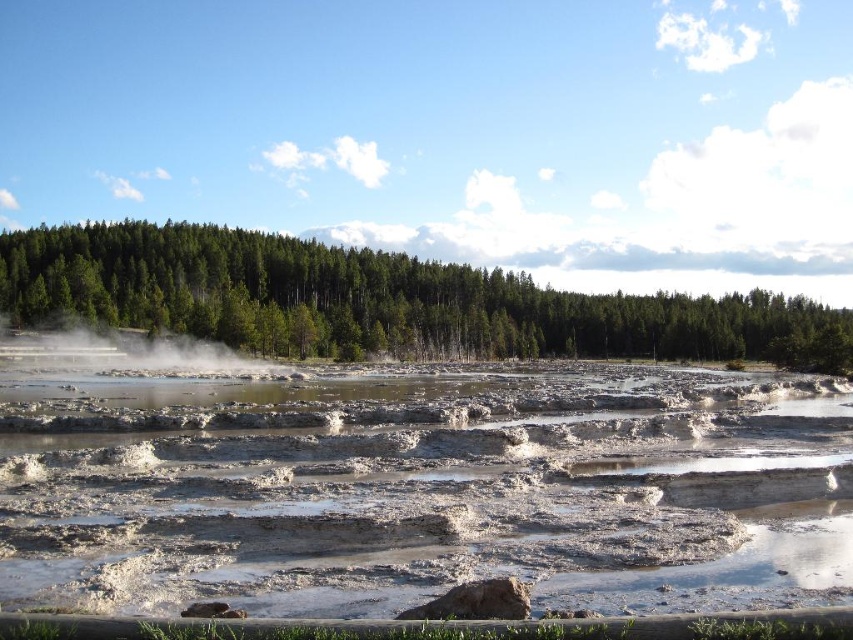
Question: Based on their relative distances, which object is nearer to the muddy water at center?

Choices:
 (A) green matte forest at center
 (B) white misty steam at center

Answer: (B)

Question: Does green matte forest at center appear over white misty steam at center?

Choices:
 (A) no
 (B) yes

Answer: (B)

Question: Estimate the real-world distances between objects in this image. Which object is farther from the white misty steam at center?

Choices:
 (A) green matte forest at center
 (B) muddy water at center

Answer: (A)

Question: Which is farther from the white misty steam at center?

Choices:
 (A) muddy water at center
 (B) green matte forest at center

Answer: (B)

Question: Is the position of muddy water at center more distant than that of green matte forest at center?

Choices:
 (A) no
 (B) yes

Answer: (A)

Question: Does muddy water at center have a lesser width compared to green matte forest at center?

Choices:
 (A) no
 (B) yes

Answer: (B)